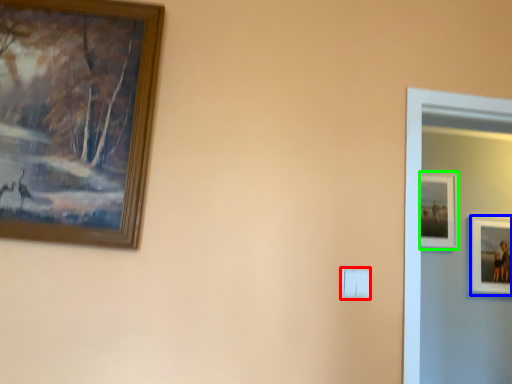
Question: Based on their relative distances, which object is nearer to light switch (highlighted by a red box)? Choose from picture frame (highlighted by a blue box) and picture frame (highlighted by a green box).

Choices:
 (A) picture frame
 (B) picture frame

Answer: (B)